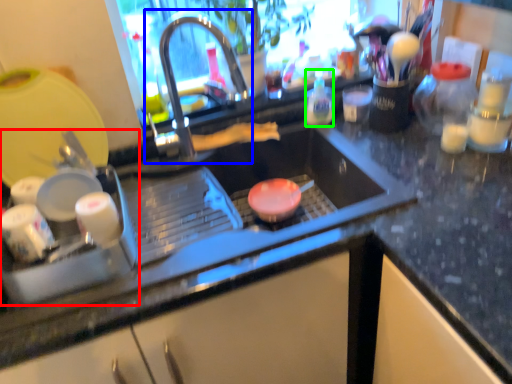
Question: Considering the real-world distances, which object is farthest from appliance (highlighted by a red box)? tap (highlighted by a blue box) or bottle (highlighted by a green box)?

Choices:
 (A) tap
 (B) bottle

Answer: (B)